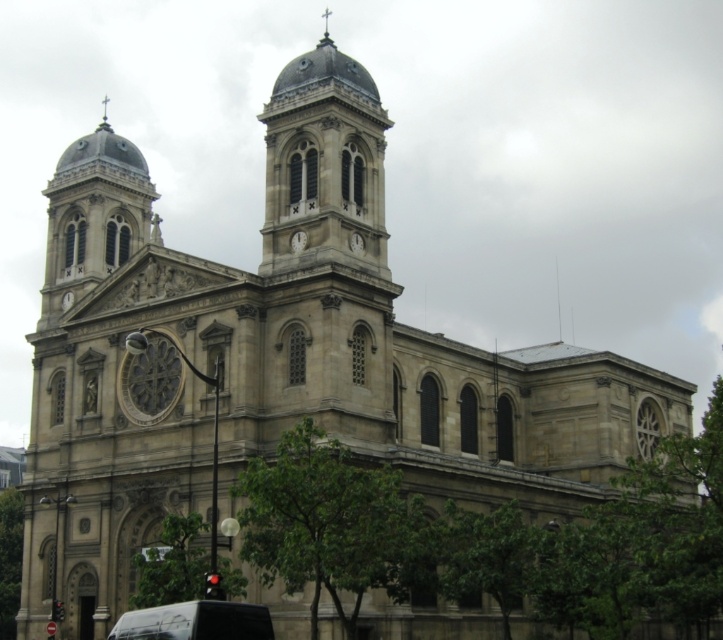
You are an architect evaluating the church facade. You need to determine which clock has a greater width between the white stone clock at center and the matte gray clock at upper center. Which one is wider?

The matte gray clock at upper center is wider than the white stone clock at center because the white stone clock at center is thinner than matte gray clock at upper center.

You are standing at the entrance of the historic church and want to reach the white stone clock at center. There is a black matte van at lower center blocking your path. Can you walk around the van to reach the clock? Please explain your reasoning.

The black matte van at lower center is 25.15 meters away from the white stone clock at center. Since the van is positioned at a distance from the clock, you can likely walk around it to reach the clock as long as there is a clear path around the van.